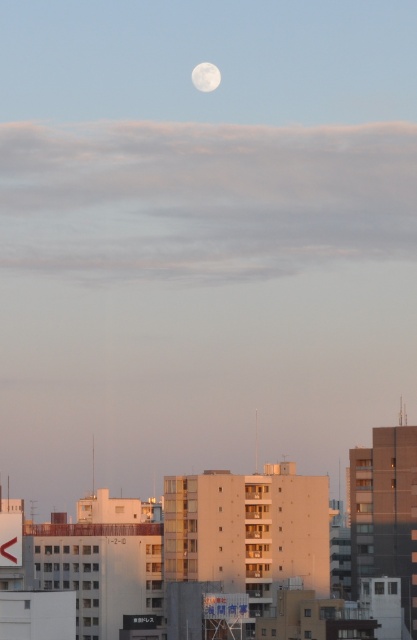
You are an architect analyzing the urban layout. From your vantage point, which object is positioned to the left of the other between the beige concrete building at center and the white matte moon at upper center?

The white matte moon at upper center is positioned to the left of the beige concrete building at center.

From the picture: You are an architect analyzing the urban layout. Given the scene, can you determine if the beige concrete building at center is directly below the white matte moon at upper center?

Yes, the beige concrete building at center is positioned under the white matte moon at upper center, so it is directly below it.

You are an architect analyzing the urban skyline. You notice the beige concrete building at center and the white matte moon at upper center. Which of these two objects occupies a larger area in the image?

The beige concrete building at center is bigger than the white matte moon at upper center, so it occupies a larger area in the image.